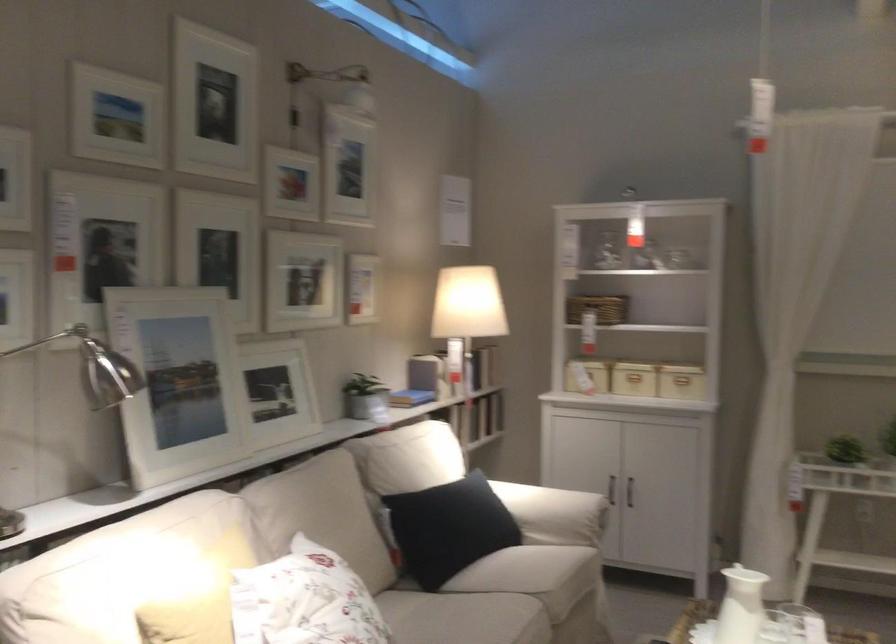
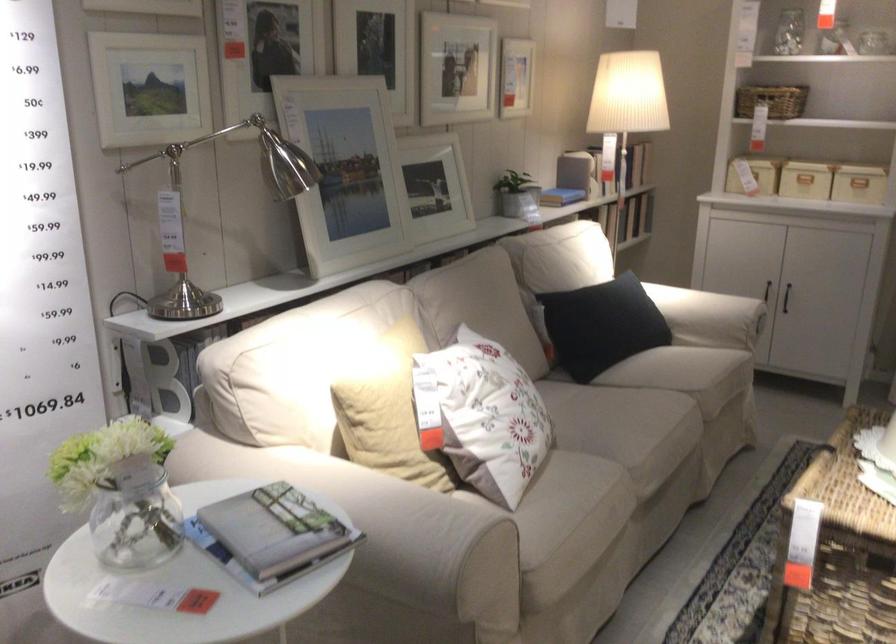
In the second image, find the point that corresponds to (x=448, y=536) in the first image.

(600, 325)